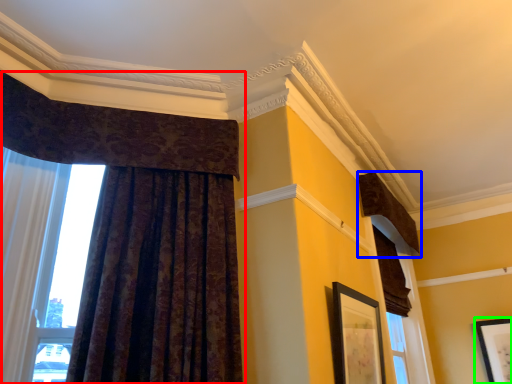
Question: Which is nearer to the curtain (highlighted by a red box)? curtain (highlighted by a blue box) or picture frame (highlighted by a green box).

Choices:
 (A) curtain
 (B) picture frame

Answer: (A)